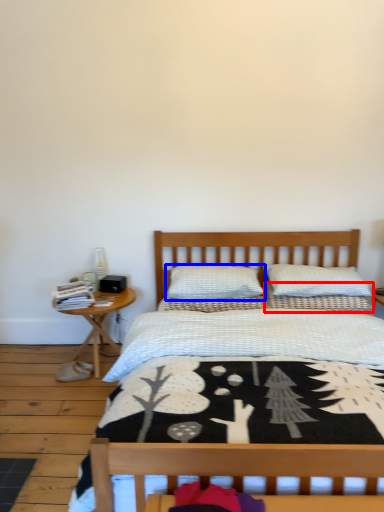
Question: Among these objects, which one is nearest to the camera, pillow (highlighted by a red box) or pillow (highlighted by a blue box)?

Choices:
 (A) pillow
 (B) pillow

Answer: (B)